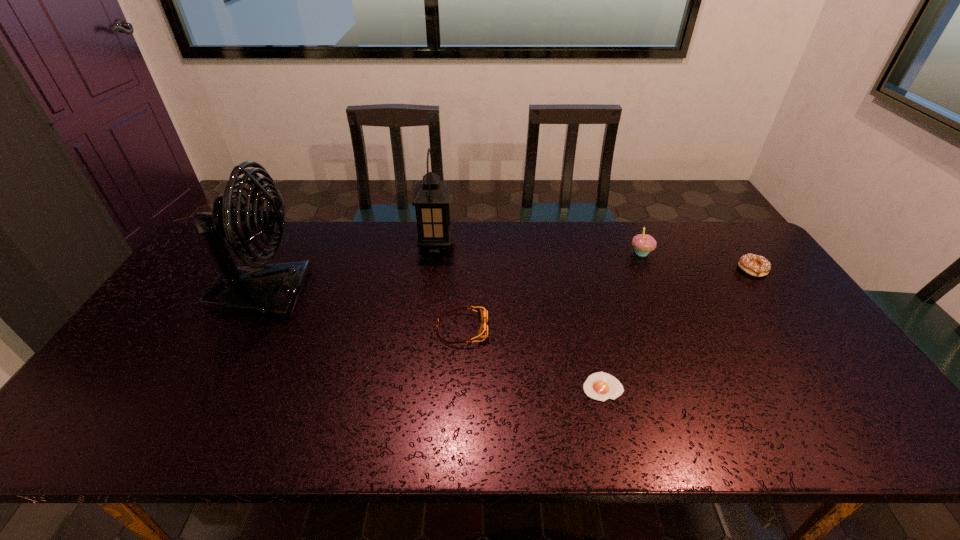
At what (x,y) coordinates should I click in order to perform the action: click on object that is at the right edge. Please return your answer as a coordinate pair (x, y). The width and height of the screenshot is (960, 540). Looking at the image, I should click on (754, 265).

This screenshot has width=960, height=540. In order to click on object positioned at the far left corner in this screenshot , I will do `click(259, 289)`.

Locate an element on the screen. object present at the far right corner is located at coordinates (754, 265).

This screenshot has height=540, width=960. Find the location of `vacant space at the far edge of the desktop`. vacant space at the far edge of the desktop is located at coordinates (342, 226).

The height and width of the screenshot is (540, 960). What are the coordinates of `free space at the near edge of the desktop` in the screenshot? It's located at (319, 429).

Find the location of a particular element. Image resolution: width=960 pixels, height=540 pixels. vacant space at the right edge of the desktop is located at coordinates (740, 278).

In the image, there is a desktop. Where is `vacant area at the far right corner`? Image resolution: width=960 pixels, height=540 pixels. vacant area at the far right corner is located at coordinates (733, 258).

Identify the location of free space at the near right corner. (858, 443).

I want to click on vacant space that's between the lantern and the third object from right to left, so click(519, 316).

The image size is (960, 540). Identify the location of vacant point located between the fourth object from left to right and the rightmost object. (678, 328).